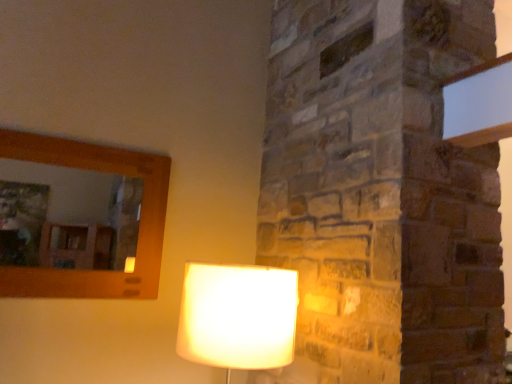
This screenshot has width=512, height=384. I want to click on white fabric lampshade at lower center, so click(x=238, y=316).

The width and height of the screenshot is (512, 384). Describe the element at coordinates (238, 316) in the screenshot. I see `white fabric lampshade at lower center` at that location.

Image resolution: width=512 pixels, height=384 pixels. In order to click on white fabric lampshade at lower center in this screenshot , I will do `click(238, 316)`.